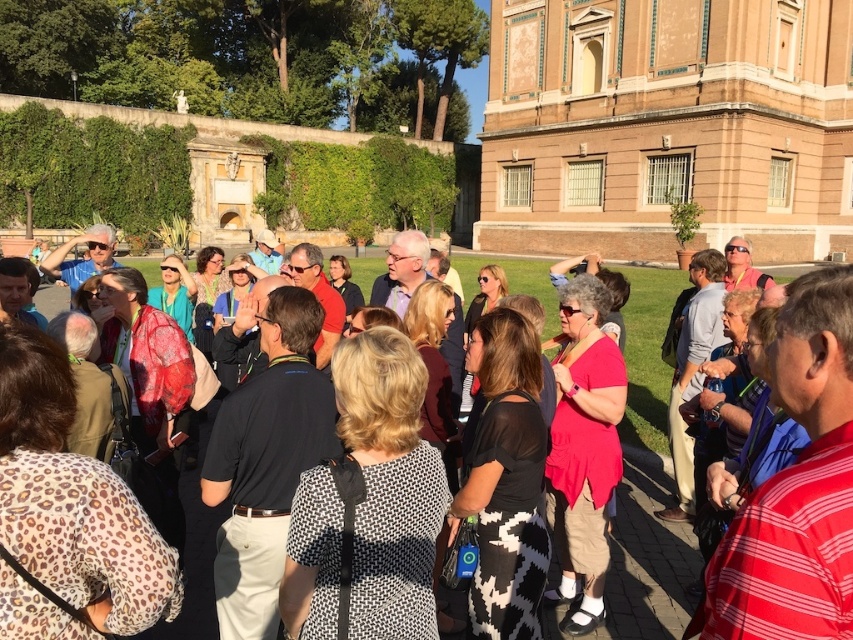
Is matte pink blouse at center taller than blonde hair at center?

Yes, matte pink blouse at center is taller than blonde hair at center.

Is point (605, 368) positioned in front of point (416, 291)?

Yes, it is in front of point (416, 291).

Measure the distance between point (579, 321) and camera.

Point (579, 321) and camera are 38.53 meters apart from each other.

Find the location of a particular element. The image size is (853, 640). matte pink blouse at center is located at coordinates (583, 451).

Between red striped shirt at center and gray fabric jacket at center, which one has more height?

With more height is gray fabric jacket at center.

Identify the location of red striped shirt at center. (796, 486).

At what (x,y) coordinates should I click in order to perform the action: click on red striped shirt at center. Please return your answer as a coordinate pair (x, y). The image size is (853, 640). Looking at the image, I should click on (796, 486).

Is leopard print dress at lower left smaller than red striped shirt at center?

Indeed, leopard print dress at lower left has a smaller size compared to red striped shirt at center.

Can you confirm if leopard print dress at lower left is positioned to the left of red striped shirt at center?

Indeed, leopard print dress at lower left is positioned on the left side of red striped shirt at center.

Is point (137, 552) closer to camera compared to point (798, 525)?

That is False.

Where is `leopard print dress at lower left`? leopard print dress at lower left is located at coordinates (68, 513).